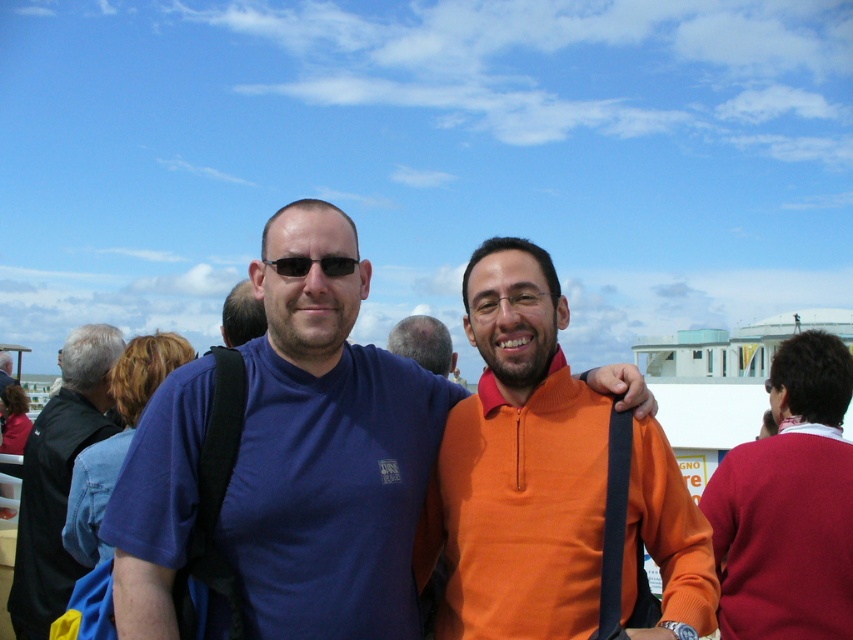
Consider the image. You are a photographer trying to capture a photo of the orange matte sweater at right and the blue cotton shirt at left. Since you want to ensure both subjects are fully visible, which subject should you adjust your camera angle to focus on first to account for their height difference?

The orange matte sweater at right is not as tall as the blue cotton shirt at left, so you should focus on the blue cotton shirt at left first to ensure its full height is captured before adjusting for the shorter orange matte sweater at right.